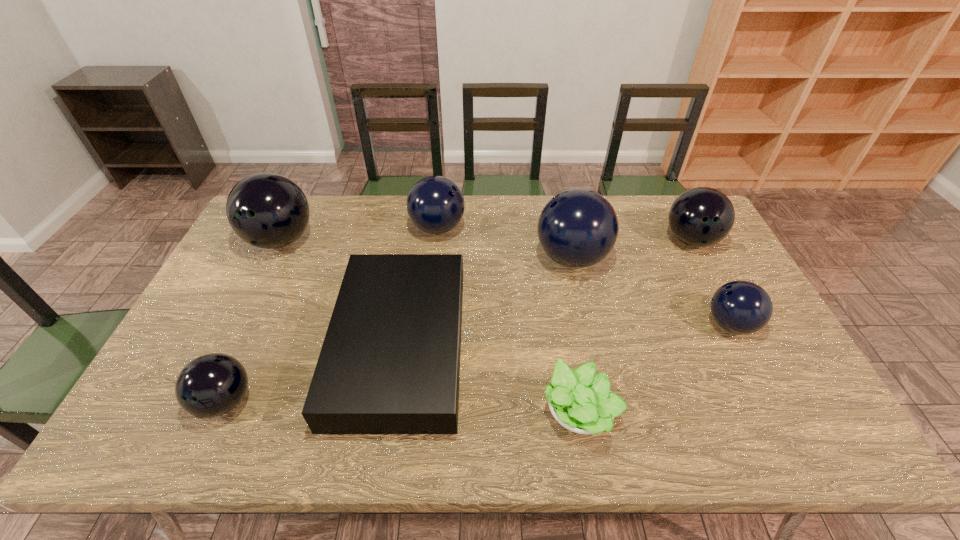
Image resolution: width=960 pixels, height=540 pixels. Identify the location of the fourth bowling ball from left to right. (577, 228).

Locate an element on the screen. The width and height of the screenshot is (960, 540). the biggest blue bowling ball is located at coordinates (577, 228).

This screenshot has height=540, width=960. Find the location of `the biggest black bowling ball`. the biggest black bowling ball is located at coordinates (266, 210).

Identify the location of the second smallest blue bowling ball. Image resolution: width=960 pixels, height=540 pixels. (435, 204).

Identify the location of the leftmost blue bowling ball. (435, 204).

In order to click on the rightmost black bowling ball in this screenshot , I will do 703,216.

You are a GUI agent. You are given a task and a screenshot of the screen. Output one action in this format:
    pyautogui.click(x=<x>, y=<y>)
    Task: Click on the second nearest bowling ball
    The image size is (960, 540).
    Given the screenshot: What is the action you would take?
    pyautogui.click(x=742, y=307)

Image resolution: width=960 pixels, height=540 pixels. Find the location of `the smallest blue bowling ball`. the smallest blue bowling ball is located at coordinates (742, 307).

Where is `the nearest black bowling ball`? Image resolution: width=960 pixels, height=540 pixels. the nearest black bowling ball is located at coordinates (211, 385).

You are a GUI agent. You are given a task and a screenshot of the screen. Output one action in this format:
    pyautogui.click(x=<x>, y=<y>)
    Task: Click on the nearest bowling ball
    The height and width of the screenshot is (540, 960).
    Given the screenshot: What is the action you would take?
    pyautogui.click(x=211, y=385)